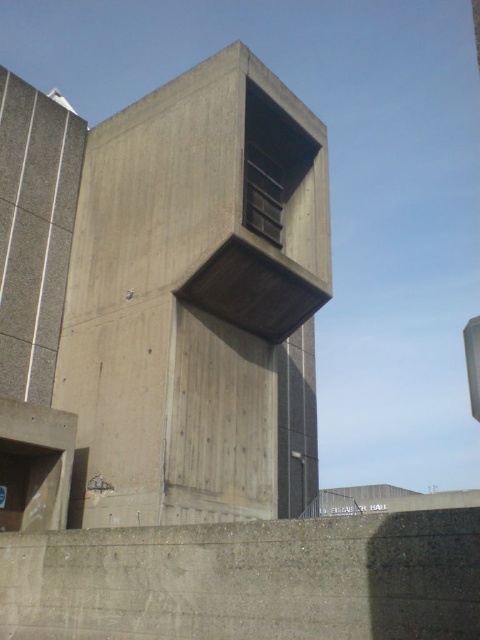
Can you confirm if concrete/rough tower at center is positioned below gray concrete wall at lower center?

Actually, concrete/rough tower at center is above gray concrete wall at lower center.

Can you confirm if concrete/rough tower at center is positioned to the right of gray concrete wall at lower center?

Yes, concrete/rough tower at center is to the right of gray concrete wall at lower center.

I want to click on concrete/rough tower at center, so click(x=194, y=298).